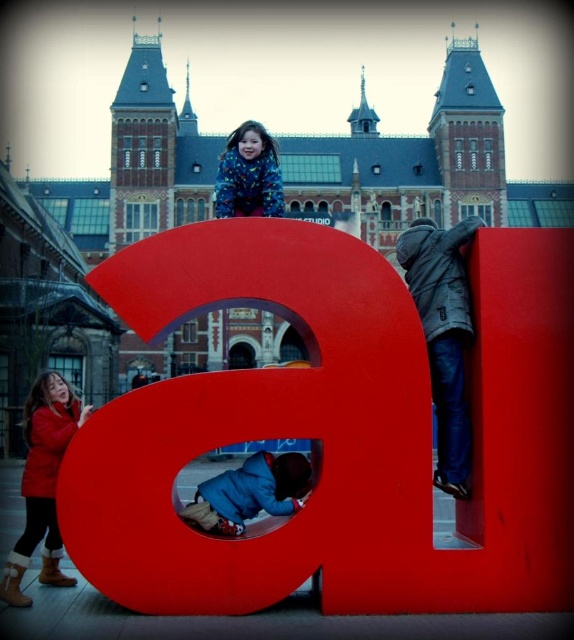
Question: Which of the following is the farthest from the observer?

Choices:
 (A) (29, 476)
 (B) (308, 472)
 (C) (222, 198)

Answer: (C)

Question: Does red leather coat at lower left appear on the left side of blue fleece jacket at lower center?

Choices:
 (A) yes
 (B) no

Answer: (A)

Question: Which point is closer to the camera?

Choices:
 (A) (235, 520)
 (B) (71, 410)

Answer: (A)

Question: Can you confirm if dark gray jacket at right is smaller than red leather coat at lower left?

Choices:
 (A) no
 (B) yes

Answer: (A)

Question: Which point is farther to the camera?

Choices:
 (A) blue fleece jacket at lower center
 (B) dark gray jacket at right
 (C) red leather coat at lower left
 (D) fluffy blue jacket at center

Answer: (D)

Question: Does dark gray jacket at right lie in front of blue fleece jacket at lower center?

Choices:
 (A) no
 (B) yes

Answer: (A)